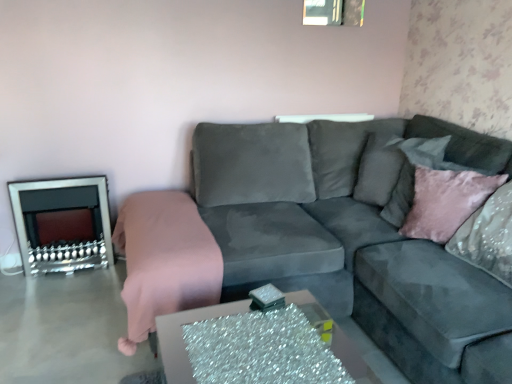
The height and width of the screenshot is (384, 512). What are the coordinates of `vacant space underneath silver metallic fireplace at left (from a real-world perspective)` in the screenshot? It's located at (65, 266).